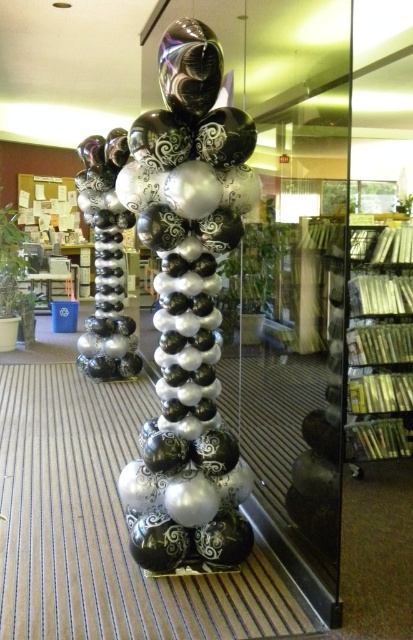
Question: Which point is closer to the camera taking this photo?

Choices:
 (A) (170, 385)
 (B) (396, 266)

Answer: (A)

Question: Is black glossy balloons at center closer to the viewer compared to metallic silver books at right?

Choices:
 (A) no
 (B) yes

Answer: (B)

Question: Is the position of black glossy balloons at center more distant than that of metallic silver books at right?

Choices:
 (A) no
 (B) yes

Answer: (A)

Question: Which of the following is the closest to the observer?

Choices:
 (A) (178, 93)
 (B) (405, 420)

Answer: (A)

Question: In this image, where is black glossy balloons at center located relative to metallic silver books at right?

Choices:
 (A) right
 (B) left

Answer: (B)